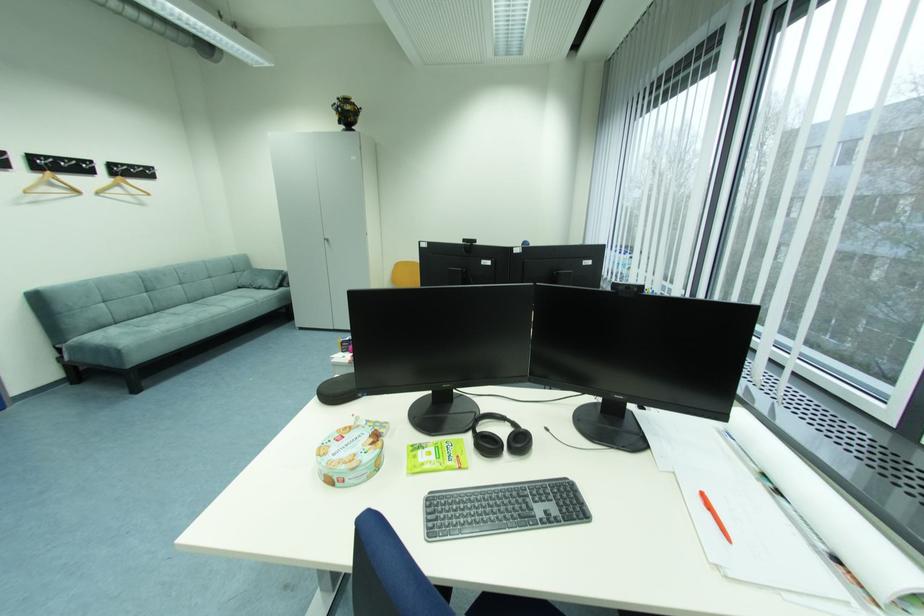
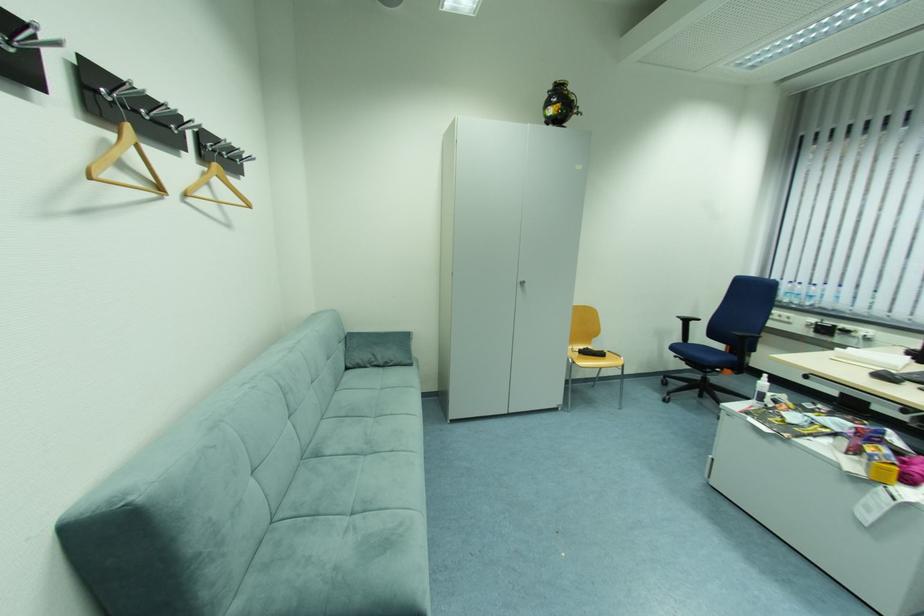
Where in the second image is the point corresponding to (x=246, y=288) from the first image?

(354, 370)